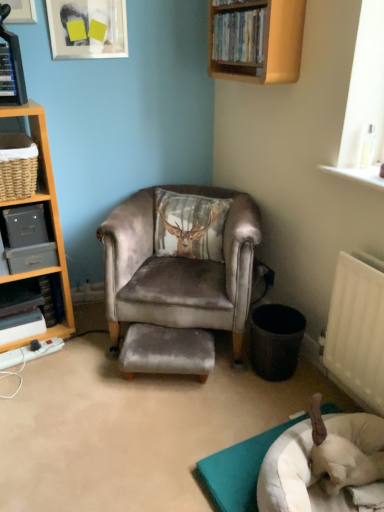
I want to click on vacant space in front of velvet grey armchair at center, so click(168, 424).